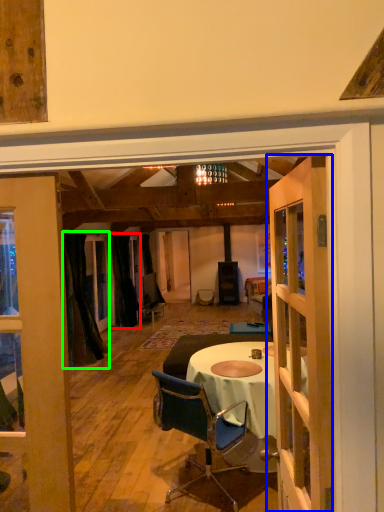
Question: Based on their relative distances, which object is farther from curtain (highlighted by a red box)? Choose from door (highlighted by a blue box) and curtain (highlighted by a green box).

Choices:
 (A) door
 (B) curtain

Answer: (A)